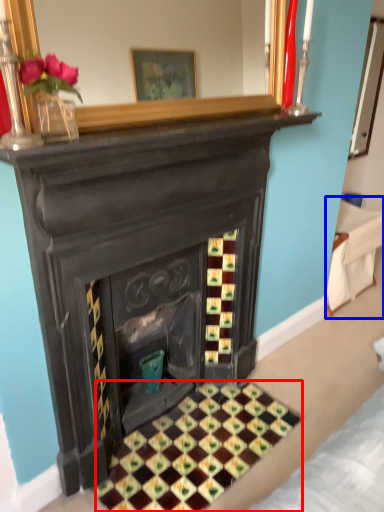
Question: Among these objects, which one is farthest to the camera, pattern (highlighted by a red box) or furniture (highlighted by a blue box)?

Choices:
 (A) pattern
 (B) furniture

Answer: (B)